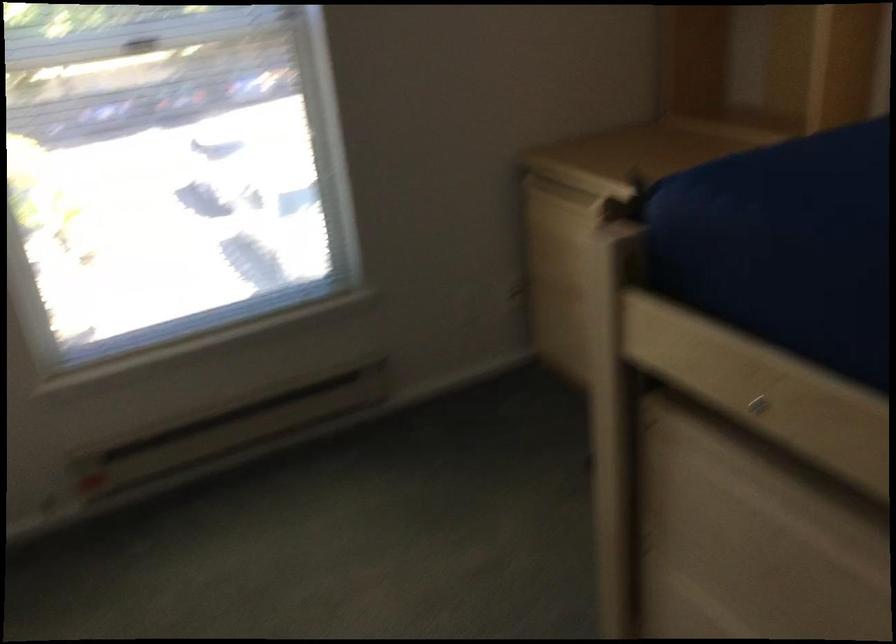
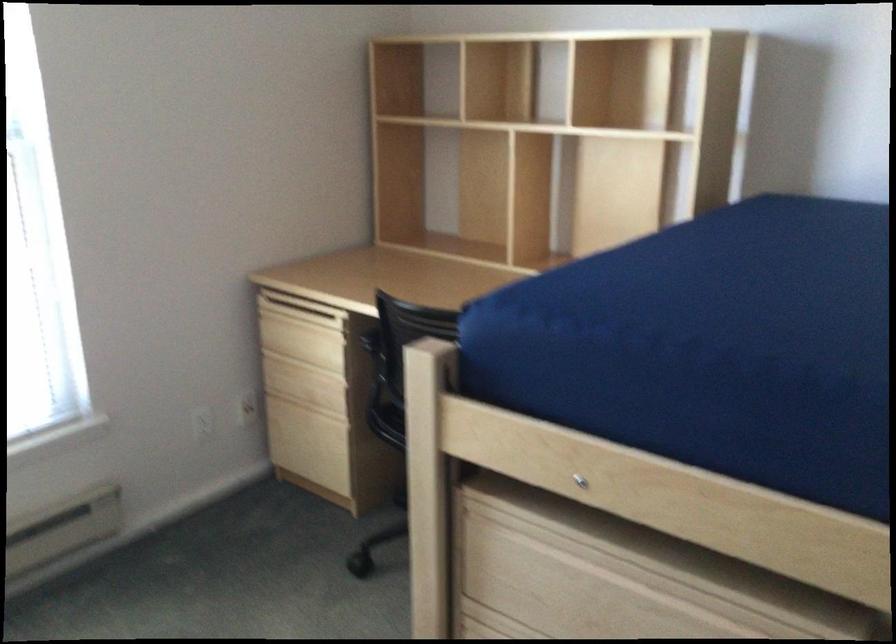
In the second image, find the point that corresponds to point 541,202 in the first image.

(285, 319)